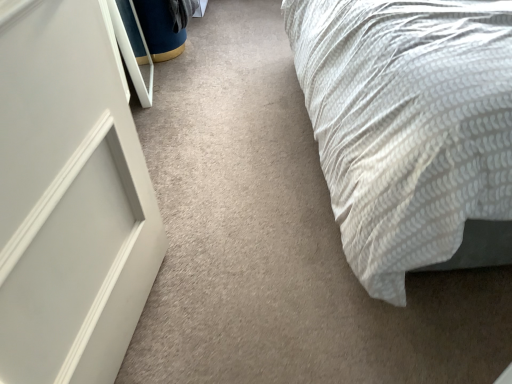
Locate an element on the screen. white textured bed at right is located at coordinates click(407, 124).

What do you see at coordinates (407, 124) in the screenshot? The height and width of the screenshot is (384, 512). I see `white textured bed at right` at bounding box center [407, 124].

You are a GUI agent. You are given a task and a screenshot of the screen. Output one action in this format:
    pyautogui.click(x=<x>, y=<y>)
    Task: Click on the white textured bed at right
    
    Given the screenshot: What is the action you would take?
    pyautogui.click(x=407, y=124)